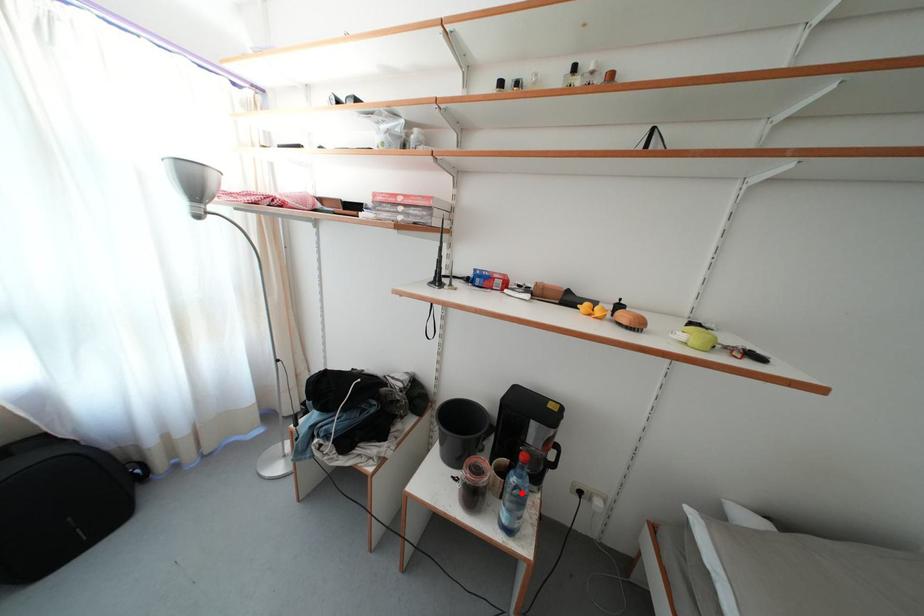
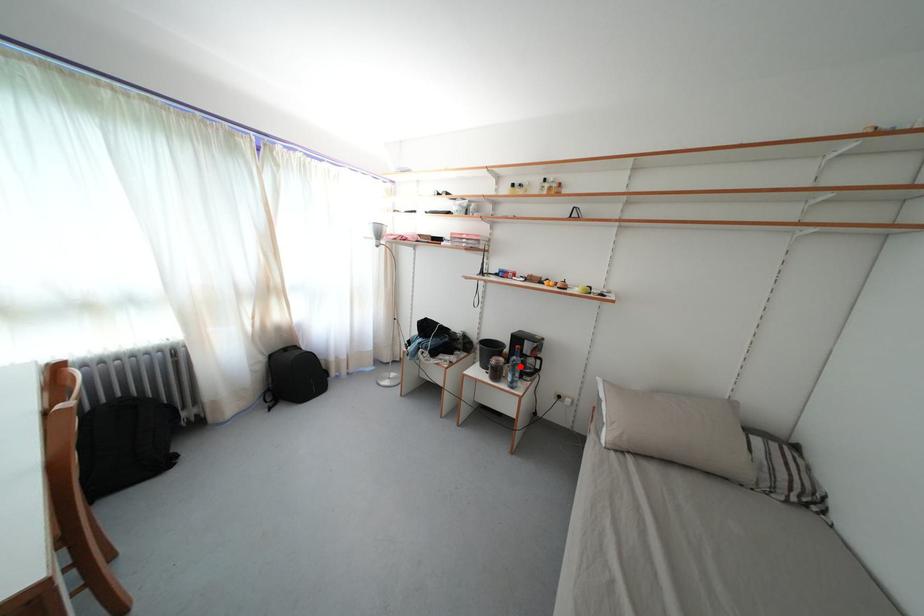
I am providing you with two images of the same scene from different viewpoints. A red point is marked on the first image and another point is marked on the second image. Is the marked point in image1 the same physical position as the marked point in image2?

Yes